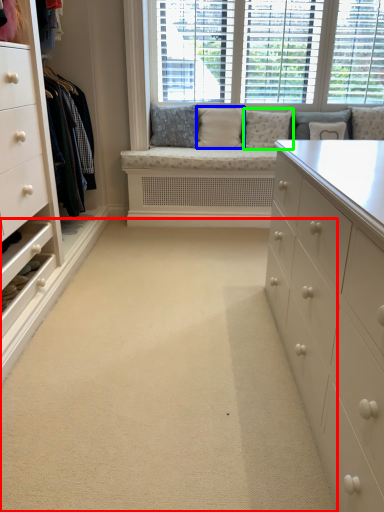
Question: Which object is the farthest from plain (highlighted by a red box)? Choose among these: pillow (highlighted by a blue box) or pillow (highlighted by a green box).

Choices:
 (A) pillow
 (B) pillow

Answer: (A)